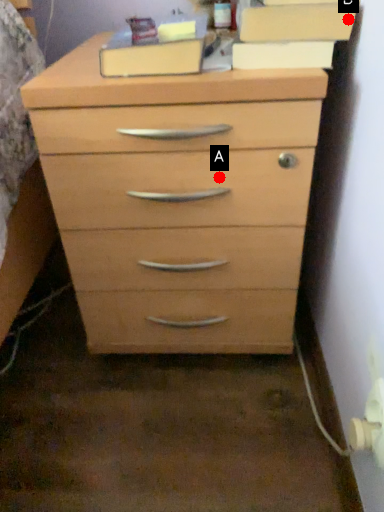
Question: Two points are circled on the image, labeled by A and B beside each circle. Among these points, which one is nearest to the camera?

Choices:
 (A) A is closer
 (B) B is closer

Answer: (B)